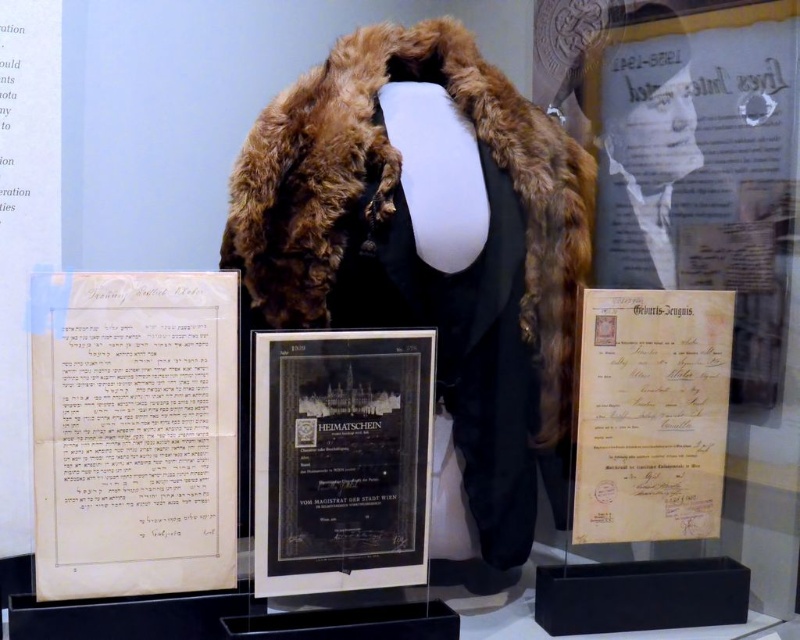
Can you confirm if brown fur coat at center is wider than white paper document at left?

Indeed, brown fur coat at center has a greater width compared to white paper document at left.

The height and width of the screenshot is (640, 800). Describe the element at coordinates (430, 244) in the screenshot. I see `brown fur coat at center` at that location.

Is point (364, 109) closer to viewer compared to point (160, 524)?

No, (364, 109) is further to viewer.

The width and height of the screenshot is (800, 640). I want to click on brown fur coat at center, so click(x=430, y=244).

Does black glass plaque at center have a greater height compared to yellow paper document at center?

Incorrect, black glass plaque at center's height is not larger of yellow paper document at center's.

Find the location of a particular element. The height and width of the screenshot is (640, 800). black glass plaque at center is located at coordinates (341, 460).

What do you see at coordinates (341, 460) in the screenshot? I see `black glass plaque at center` at bounding box center [341, 460].

In order to click on black glass plaque at center in this screenshot , I will do pos(341,460).

Does brown fur coat at center have a greater width compared to yellow paper document at center?

Yes, brown fur coat at center is wider than yellow paper document at center.

Image resolution: width=800 pixels, height=640 pixels. Describe the element at coordinates (430, 244) in the screenshot. I see `brown fur coat at center` at that location.

Find the location of a particular element. brown fur coat at center is located at coordinates (430, 244).